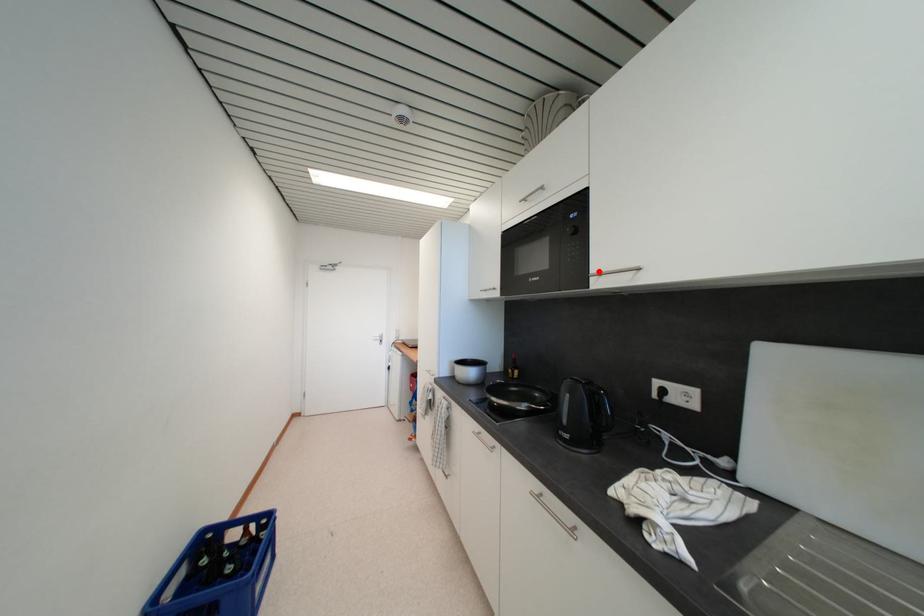
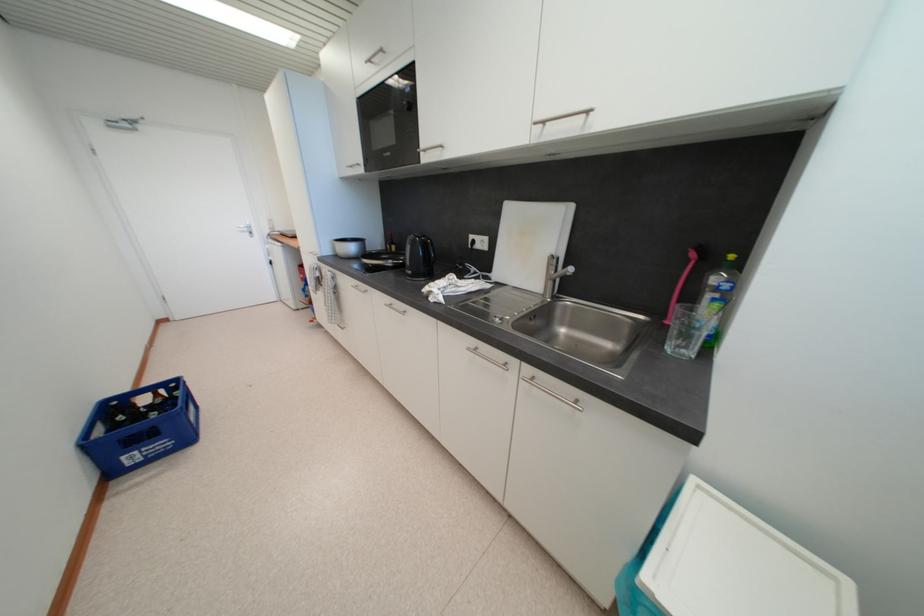
Question: I am providing you with two images of the same scene from different viewpoints. A red point is marked on the first image. Is the red point's position out of view in image 2?

Choices:
 (A) Yes
 (B) No

Answer: (B)